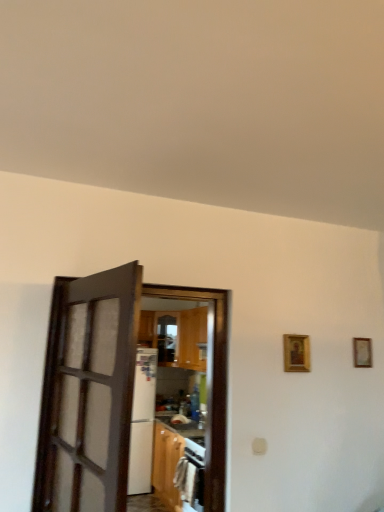
Question: From a real-world perspective, is gold-framed picture at upper right, the first picture frame in the left-to-right sequence, located beneath gold-framed picture at right, which is the first picture frame in right-to-left order?

Choices:
 (A) yes
 (B) no

Answer: (A)

Question: Can you confirm if gold-framed picture at upper right, the 2th picture frame when ordered from back to front, is shorter than gold-framed picture at right, the 2th picture frame from the left?

Choices:
 (A) yes
 (B) no

Answer: (B)

Question: Is the position of gold-framed picture at upper right, the first picture frame in the left-to-right sequence, less distant than that of gold-framed picture at right, the 2th picture frame from the left?

Choices:
 (A) no
 (B) yes

Answer: (B)

Question: From the image's perspective, is gold-framed picture at upper right, the first picture frame in the left-to-right sequence, located beneath gold-framed picture at right, which is the first picture frame in right-to-left order?

Choices:
 (A) yes
 (B) no

Answer: (B)

Question: Does gold-framed picture at upper right, which is the second picture frame in right-to-left order, appear on the right side of gold-framed picture at right, the 1th picture frame viewed from the back?

Choices:
 (A) yes
 (B) no

Answer: (B)

Question: Based on their sizes in the image, would you say brown wooden door at center, the second door in the front-to-back sequence, is bigger or smaller than gold-framed picture at upper right, the first picture frame in the left-to-right sequence?

Choices:
 (A) big
 (B) small

Answer: (A)

Question: In the image, is brown wooden door at center, the second door in the front-to-back sequence, positioned in front of or behind gold-framed picture at upper right, the 2th picture frame when ordered from back to front?

Choices:
 (A) front
 (B) behind

Answer: (A)

Question: Which is correct: brown wooden door at center, which is counted as the first door, starting from the back, is inside gold-framed picture at upper right, the 2th picture frame when ordered from back to front, or outside of it?

Choices:
 (A) inside
 (B) outside

Answer: (B)

Question: From the image's perspective, relative to gold-framed picture at upper right, the 2th picture frame when ordered from back to front, is brown wooden door at center, which is counted as the first door, starting from the back, above or below?

Choices:
 (A) below
 (B) above

Answer: (A)

Question: Does point (296, 337) appear closer or farther from the camera than point (66, 391)?

Choices:
 (A) closer
 (B) farther

Answer: (B)

Question: Is gold-framed picture at upper right, the 2th picture frame when ordered from back to front, wider or thinner than dark wood door at left, the 1th door from the front?

Choices:
 (A) wide
 (B) thin

Answer: (B)

Question: Choose the correct answer: Is gold-framed picture at upper right, which is the second picture frame in right-to-left order, inside dark wood door at left, the 1th door from the front, or outside it?

Choices:
 (A) inside
 (B) outside

Answer: (B)

Question: From a real-world perspective, is gold-framed picture at upper right, which ranks as the first picture frame in front-to-back order, above or below dark wood door at left, the 1th door from the front?

Choices:
 (A) below
 (B) above

Answer: (B)

Question: Considering the relative positions of gold-framed picture at right, the 1th picture frame viewed from the back, and dark wood door at left, the 1th door from the front, in the image provided, is gold-framed picture at right, the 1th picture frame viewed from the back, to the left or to the right of dark wood door at left, the 1th door from the front,?

Choices:
 (A) right
 (B) left

Answer: (A)

Question: From the image's perspective, is gold-framed picture at right, the 2th picture frame from the left, above or below dark wood door at left, the 1th door from the front?

Choices:
 (A) below
 (B) above

Answer: (A)